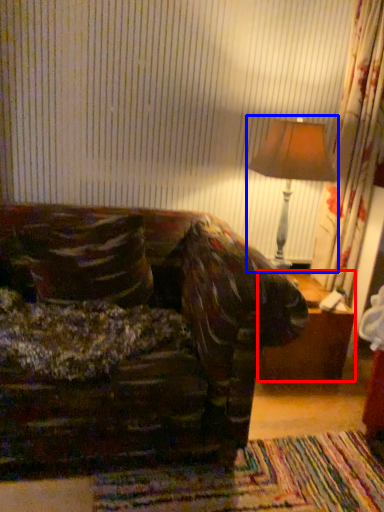
Question: Which object is further to the camera taking this photo, table (highlighted by a red box) or table lamp (highlighted by a blue box)?

Choices:
 (A) table
 (B) table lamp

Answer: (A)